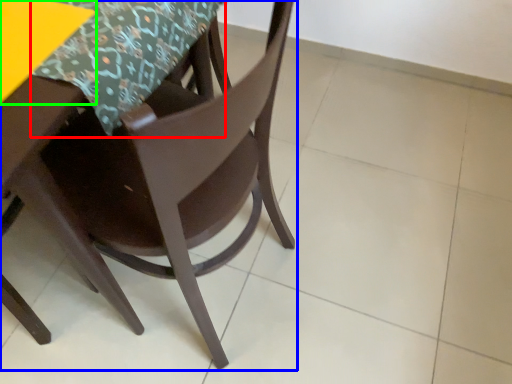
Question: Which object is positioned closest to tablecloth (highlighted by a red box)? Select from chair (highlighted by a blue box) and table (highlighted by a green box).

Choices:
 (A) chair
 (B) table

Answer: (B)